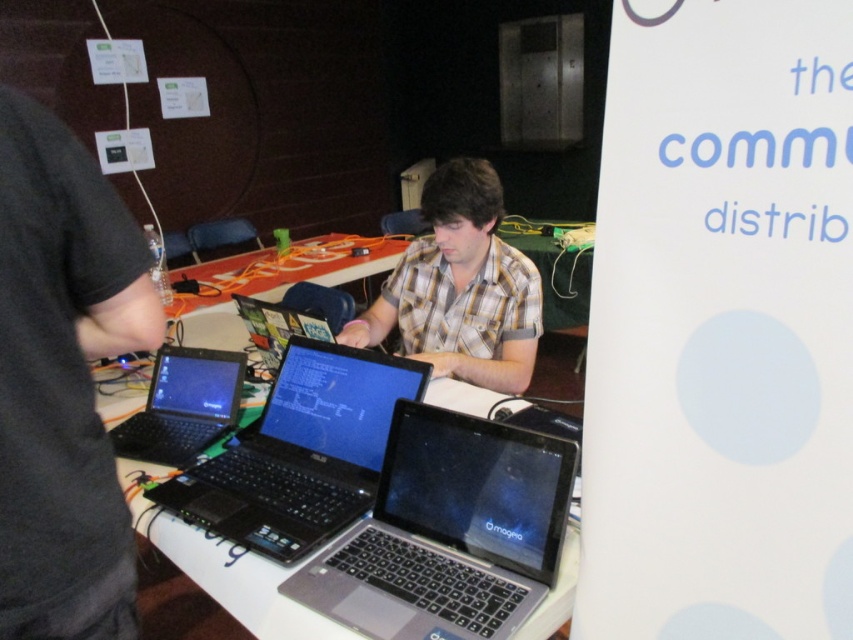
You are standing in front of the table with the three laptops. There is a specific point marked at coordinates point (386, 616). Can you reach this point without moving your body? The point is 1.01 meters away from you.

The point (386, 616) is 1.01 meters away from the viewer. Since the average arm length is about 0.7 meters, you cannot reach it without moving your body.